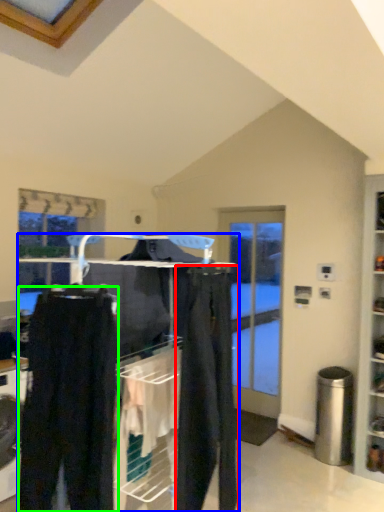
Question: Which is nearer to the clothing (highlighted by a red box)? closet (highlighted by a blue box) or trousers (highlighted by a green box).

Choices:
 (A) closet
 (B) trousers

Answer: (A)